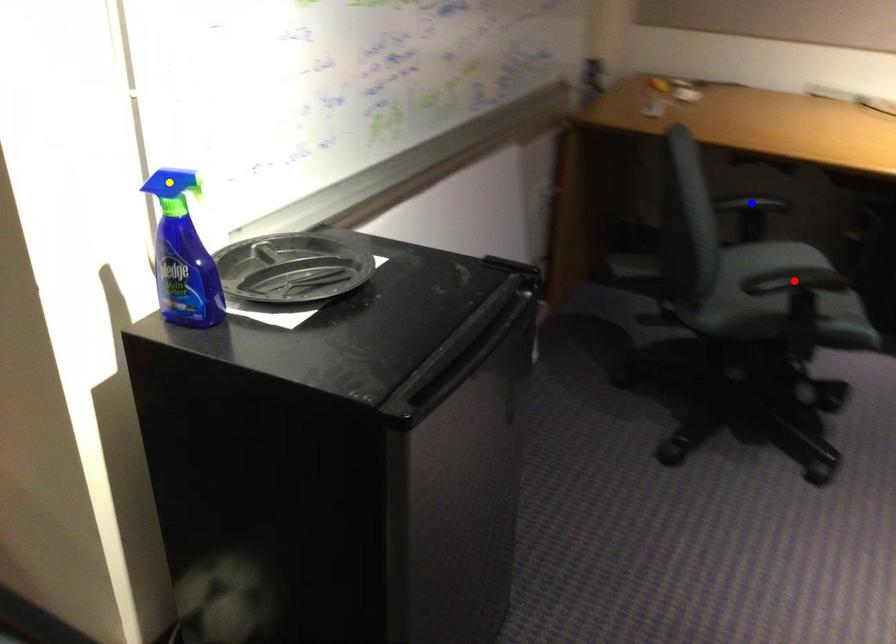
Order these from nearest to farthest:
red point
blue point
yellow point

1. yellow point
2. red point
3. blue point